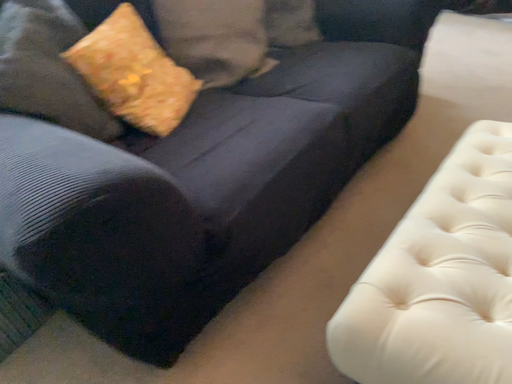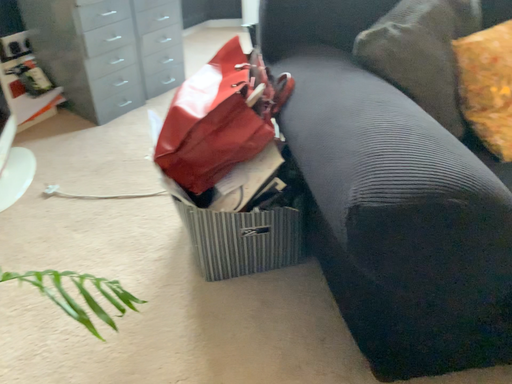
Question: How did the camera likely rotate when shooting the video?

Choices:
 (A) rotated left
 (B) rotated right

Answer: (A)